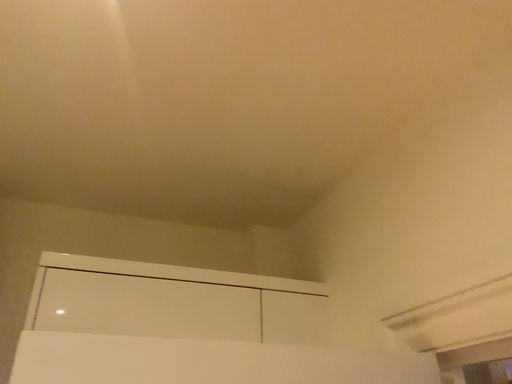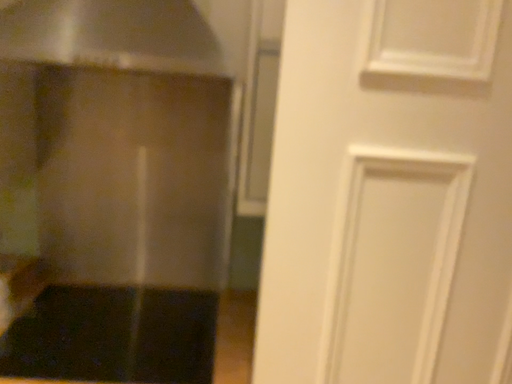
Question: Which way did the camera rotate in the video?

Choices:
 (A) rotated right
 (B) rotated left

Answer: (B)